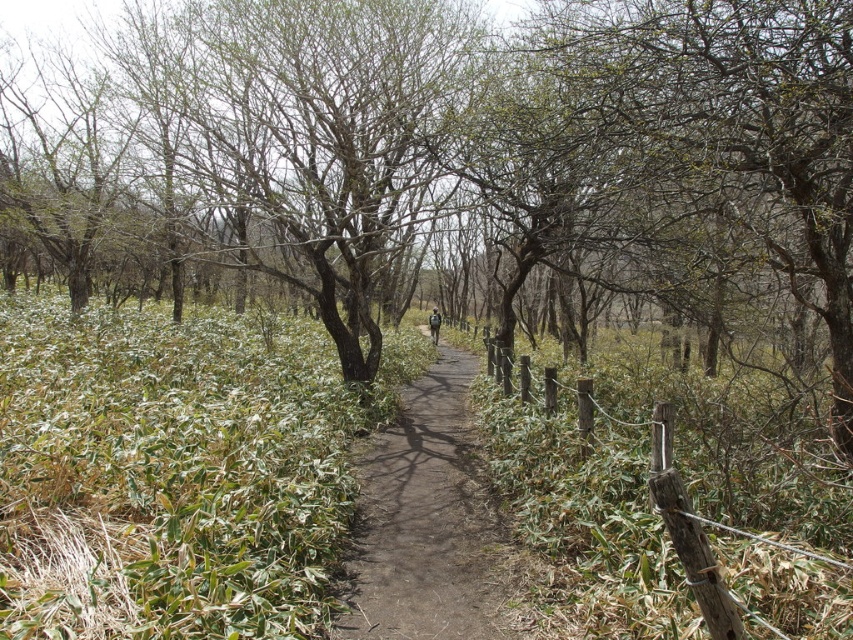
You are a hiker who wants to take a shortcut across the dirt path at center. However, there is a green leafy shrub at center blocking your way. Can you walk under the shrub to pass through?

The green leafy shrub at center is located above the dirt path at center, so yes, you can walk under the shrub to pass through the dirt path at center.

Based on the photo, you are a hiker carrying a backpack and standing at the start of the path in the forest scene. You see the green leafy shrub at center. If your backpack has a 15 feet rope, can you reach the shrub with the rope without moving closer?

The green leafy shrub at center is 16.04 feet from camera. Since the rope is only 15 feet long, it is not long enough to reach the shrub without moving closer.